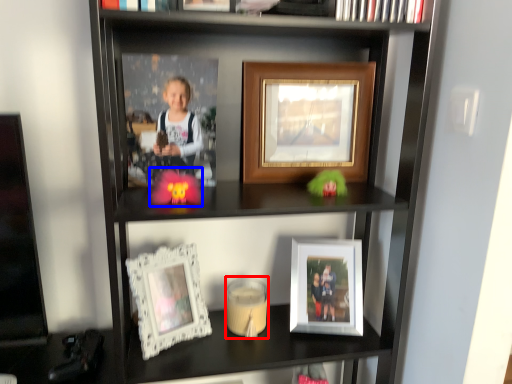
Question: Which object is closer to the camera taking this photo, candle holder (highlighted by a red box) or toy (highlighted by a blue box)?

Choices:
 (A) candle holder
 (B) toy

Answer: (B)